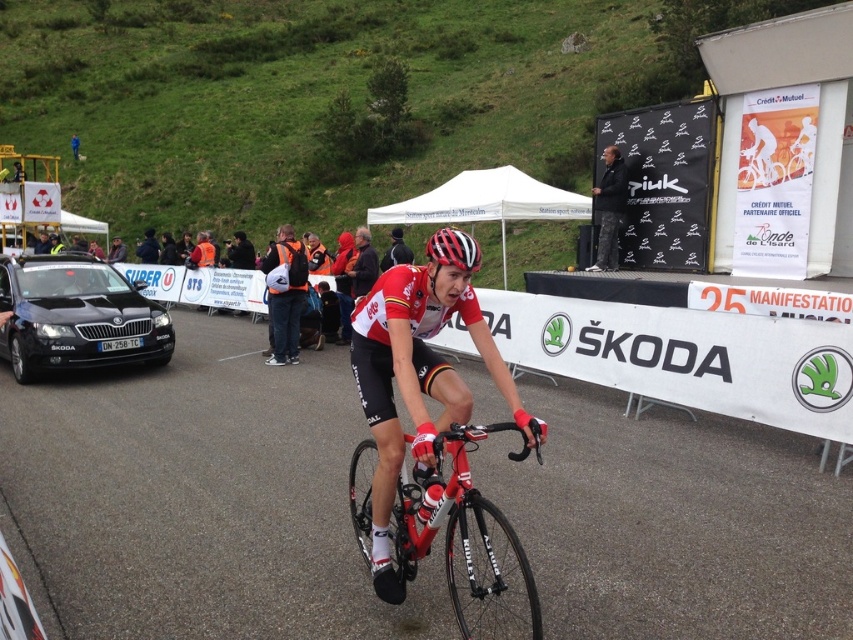
You are a photographer trying to capture the cyclist in the scene. You notice the camouflage pants at upper center and the matte black helmet at center. Which object should you focus on if you want to photograph the taller one?

The camouflage pants at upper center is taller than the matte black helmet at center, so focus on the camouflage pants at upper center.

You are a photographer positioned at the starting line of the cycling event. You want to capture a photo of both the cyclist and the parked car in the background. However, you notice two points marked on your camera screen at coordinates point (320, 588) and point (281, 259). Which point should you focus on first to ensure both subjects are in the frame?

You should focus on point (320, 588) first because it is in front of point (281, 259), ensuring both the cyclist and the parked car are within the frame.

What is the coordinate of the smooth asphalt road at center?

The coordinate of the smooth asphalt road at center is at point (196, 499).